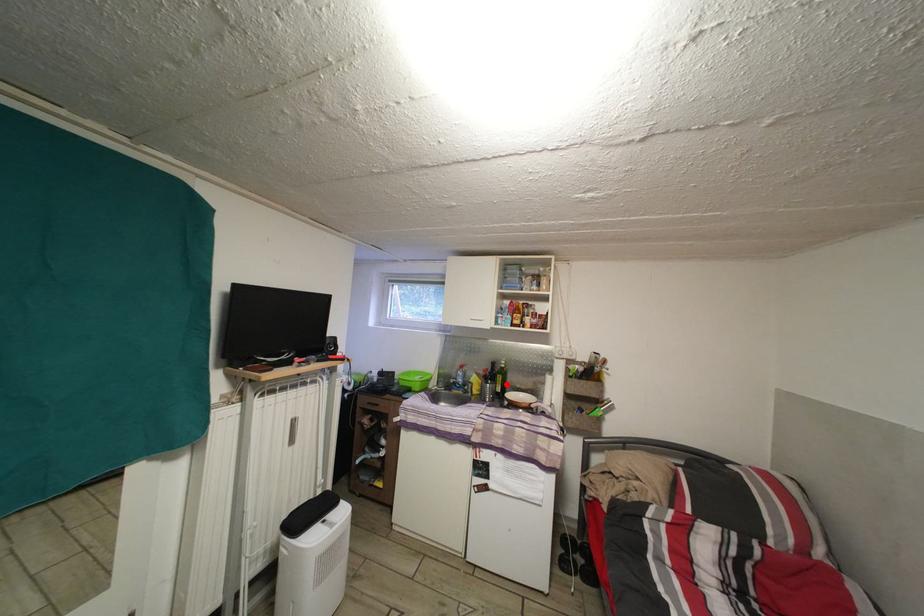
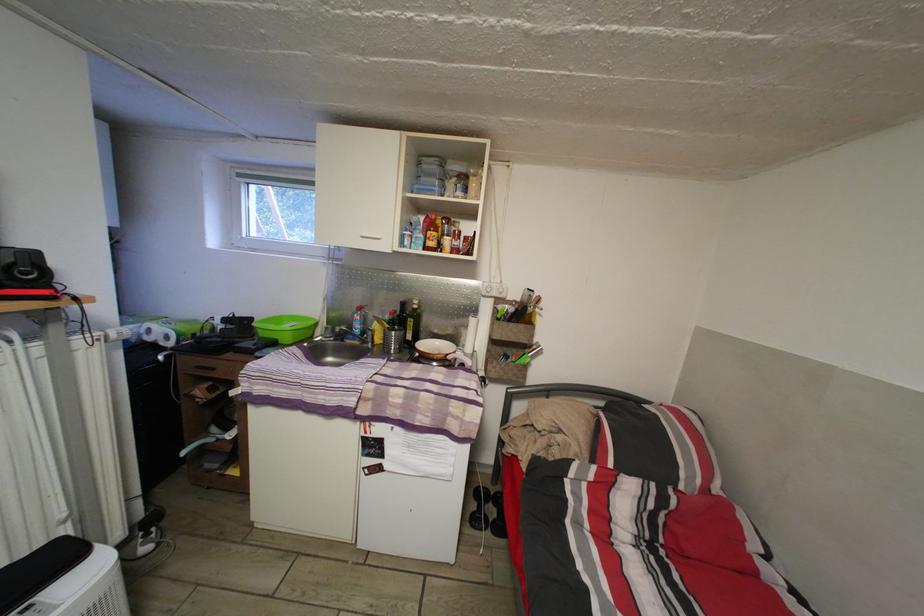
In the second image, find the point that corresponds to the highlighted location in the first image.

(418, 329)